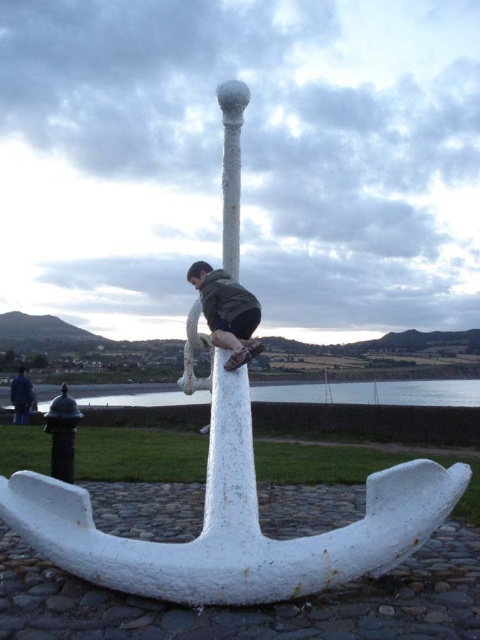
In the scene shown: Between clear water at anchor center and blue fabric jacket at lower left, which one has more height?

With more height is clear water at anchor center.

This screenshot has width=480, height=640. What do you see at coordinates (376, 392) in the screenshot?
I see `clear water at anchor center` at bounding box center [376, 392].

Between point (372, 387) and point (16, 390), which one is positioned in front?

Positioned in front is point (16, 390).

Where is `clear water at anchor center`? clear water at anchor center is located at coordinates (376, 392).

Who is more forward, (x=229, y=362) or (x=11, y=396)?

Positioned in front is point (x=229, y=362).

Which of these two, dark gray fabric jacket at center or blue fabric jacket at lower left, stands shorter?

dark gray fabric jacket at center is shorter.

Who is more distant from viewer, (205, 307) or (20, 401)?

The point (20, 401) is behind.

At what (x,y) coordinates should I click in order to perform the action: click on dark gray fabric jacket at center. Please return your answer as a coordinate pair (x, y). This screenshot has width=480, height=640. Looking at the image, I should click on (228, 312).

Can you confirm if clear water at anchor center is positioned to the left of dark gray fabric jacket at center?

Incorrect, clear water at anchor center is not on the left side of dark gray fabric jacket at center.

Which is below, clear water at anchor center or dark gray fabric jacket at center?

clear water at anchor center is lower down.

The image size is (480, 640). I want to click on clear water at anchor center, so click(x=376, y=392).